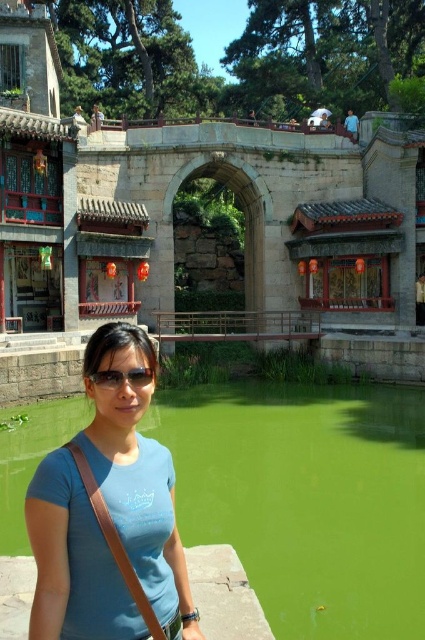
Question: Does stone archway at center have a smaller size compared to black plastic goggles at center?

Choices:
 (A) yes
 (B) no

Answer: (B)

Question: Can you confirm if green algae water at lower center is thinner than blue fabric shirt at lower left?

Choices:
 (A) no
 (B) yes

Answer: (A)

Question: Which object is positioned farthest from the blue fabric shirt at lower left?

Choices:
 (A) stone archway at center
 (B) black plastic goggles at center
 (C) green algae water at lower center

Answer: (A)

Question: Which object is farther from the camera taking this photo?

Choices:
 (A) stone archway at center
 (B) blue fabric shirt at lower left

Answer: (A)

Question: Which point is farther to the camera?

Choices:
 (A) (342, 234)
 (B) (42, 536)
 (C) (365, 488)
 (D) (130, 371)

Answer: (A)

Question: Can you confirm if green algae water at lower center is positioned to the right of blue fabric shirt at lower left?

Choices:
 (A) yes
 (B) no

Answer: (A)